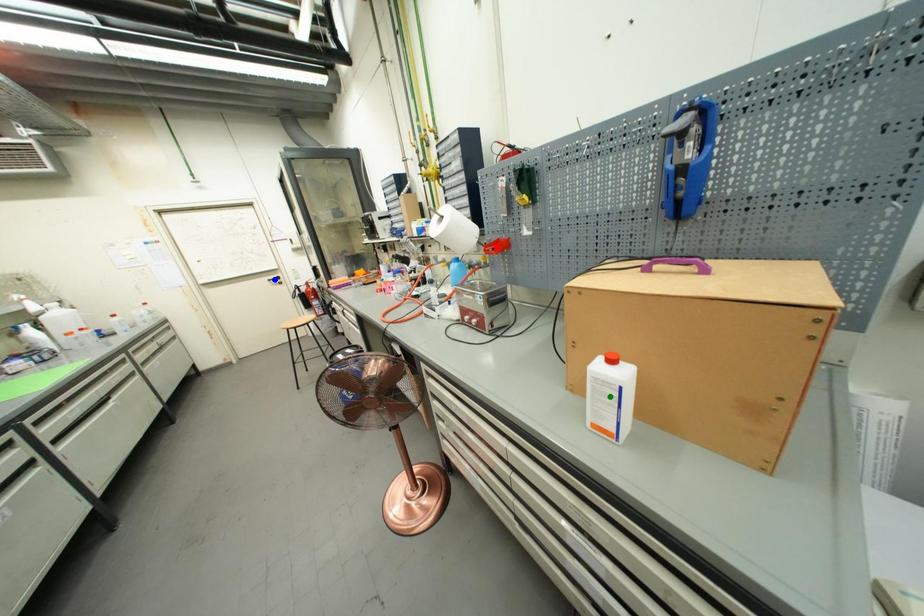
Order these from nearest to farthest:
blue point | green point | red point

blue point
red point
green point